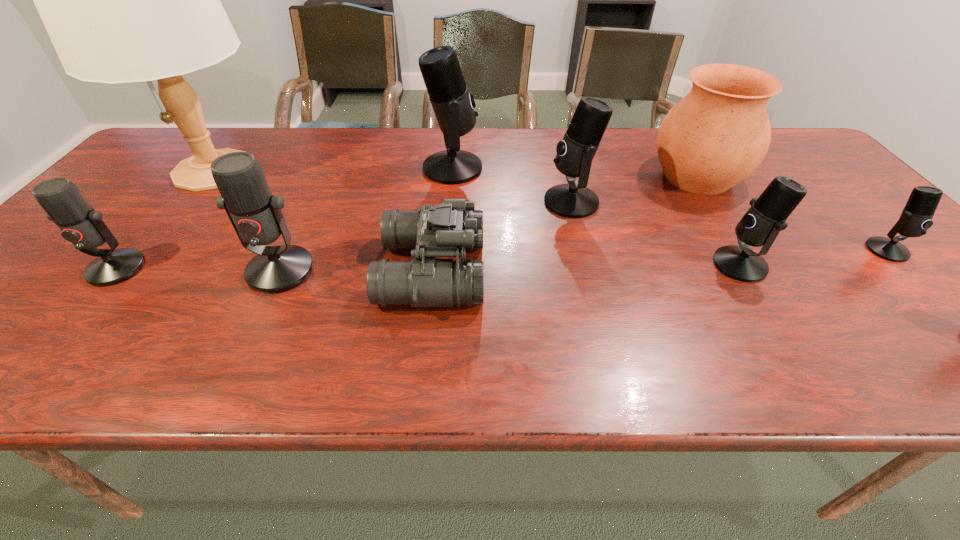
You are a GUI agent. You are given a task and a screenshot of the screen. Output one action in this format:
    pyautogui.click(x=<x>, y=<y>)
    Task: Click on the free spot located 0.100m on the stand of the fourth microphone from left to right
    The width and height of the screenshot is (960, 540).
    Given the screenshot: What is the action you would take?
    pyautogui.click(x=506, y=202)

Where is `free point located 0.220m on the stand of the fourth microphone from left to right`? free point located 0.220m on the stand of the fourth microphone from left to right is located at coordinates (460, 202).

Identify the location of vacant space positioned on the side of the right red microphone with the red ring. This screenshot has width=960, height=540. (242, 354).

What are the coordinates of `free region located 0.400m on the stand of the fifth microphone from left to right` in the screenshot? It's located at (535, 265).

Where is `vacant space located on the stand of the fifth microphone from left to right`? Image resolution: width=960 pixels, height=540 pixels. vacant space located on the stand of the fifth microphone from left to right is located at coordinates (580, 265).

This screenshot has height=540, width=960. Find the location of `free location located 0.280m on the stand of the fifth microphone from left to right`. free location located 0.280m on the stand of the fifth microphone from left to right is located at coordinates (588, 265).

Identify the location of vacant space located on the side of the smaller red microphone with the red ring. The image size is (960, 540). tap(45, 354).

At what (x,y) coordinates should I click in order to perform the action: click on free space located on the stand of the smallest black microphone. Please return your answer as a coordinate pair (x, y). This screenshot has width=960, height=540. Looking at the image, I should click on (928, 292).

What are the coordinates of `vacant point located through the lenses of the binoculars` in the screenshot? It's located at click(x=515, y=271).

At what (x,y) coordinates should I click in order to perform the action: click on table lamp at the far edge. Please return your answer as a coordinate pair (x, y). Looking at the image, I should click on (123, 0).